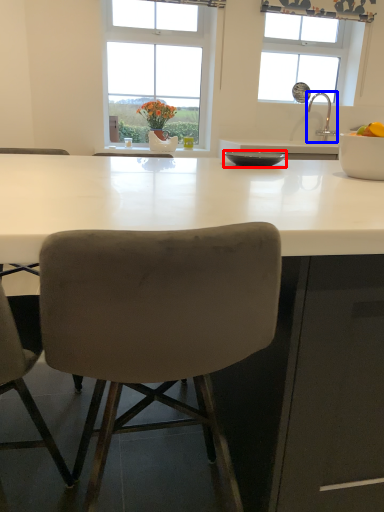
Question: Which point is further to the camera, bowl (highlighted by a red box) or tap (highlighted by a blue box)?

Choices:
 (A) bowl
 (B) tap

Answer: (B)